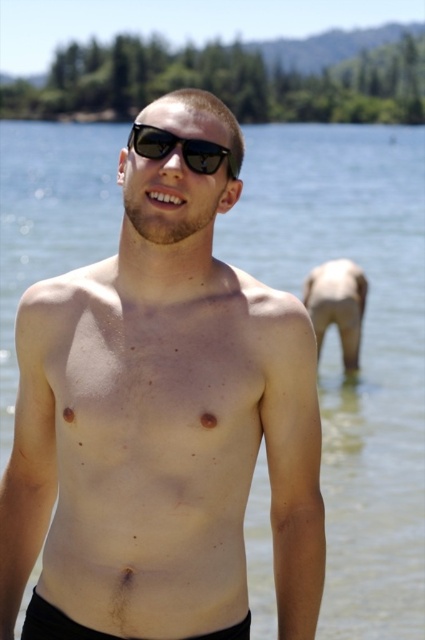
You are a photographer trying to capture the shirtless individual at the lakeside. You notice the matte skin at center and the black reflective sunglasses at center. Which object is positioned to the right side of the other?

The black reflective sunglasses at center is positioned to the right of the matte skin at center because the matte skin at center is to the left of black reflective sunglasses at center.

You are a photographer trying to capture the reflection of the matte skin at center in the water. Since the black reflective sunglasses at center might block part of the reflection, where should you position yourself relative to the person to avoid the sunglasses obstructing the view?

The black reflective sunglasses at center are behind matte skin at center, so positioning yourself directly in front of the person, aligned with the matte skin at center, would ensure the sunglasses do not block the reflection.

You are standing at point (158, 138) and want to move to the water. Is the point (163, 244) behind you or in front of you?

The point (163, 244) is behind point (158, 138), so it is behind you.